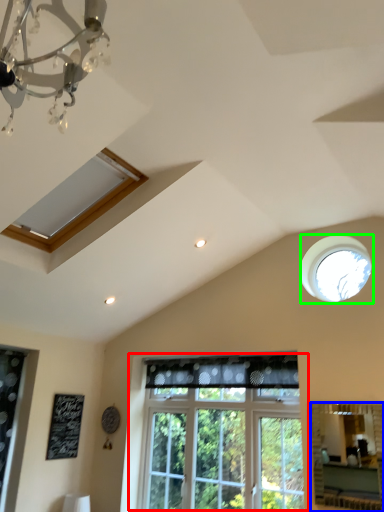
Question: Considering the real-world distances, which object is farthest from window (highlighted by a red box)? mirror (highlighted by a blue box) or window (highlighted by a green box)?

Choices:
 (A) mirror
 (B) window

Answer: (B)